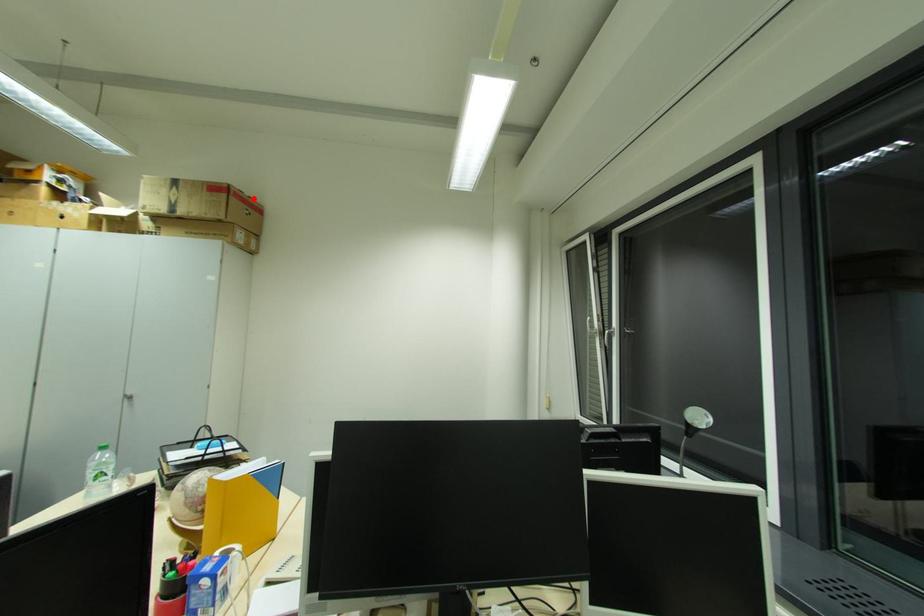
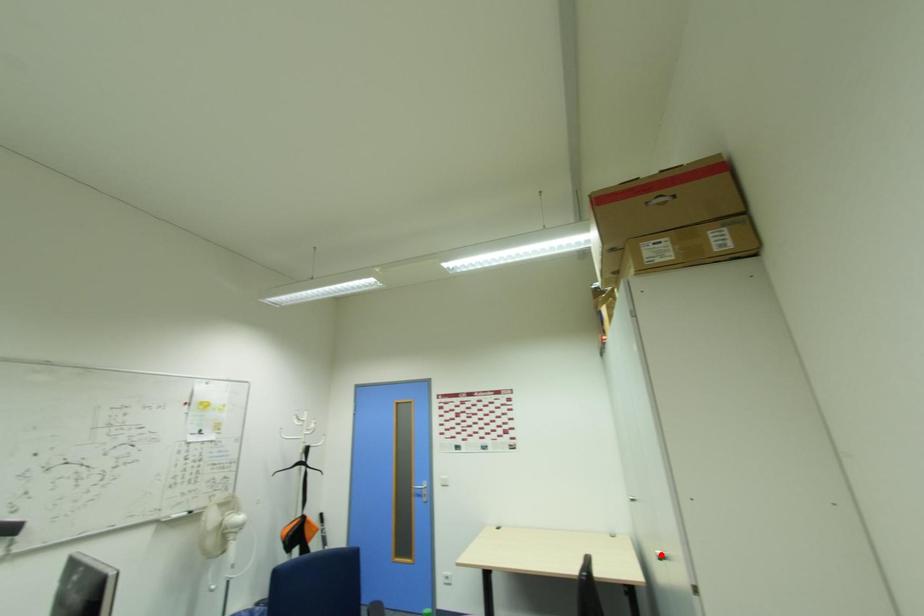
I am providing you with two images of the same scene from different viewpoints. A red point is marked on the first image and another point is marked on the second image. Does the point marked in image1 correspond to the same location as the one in image2?

No